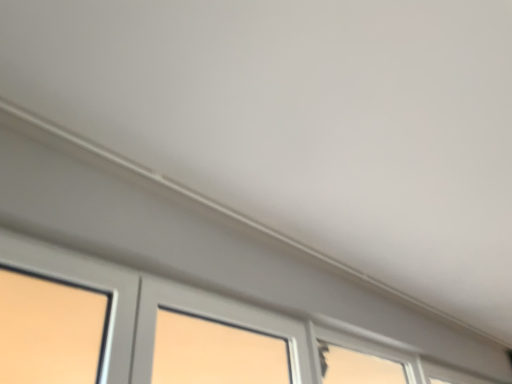
Question: Can we say matte gray window at lower left, the 1th window in the front-to-back sequence, lies outside clear glass window at lower right, arranged as the 1th window when viewed from the right?

Choices:
 (A) yes
 (B) no

Answer: (A)

Question: Does matte gray window at lower left, the 1th window in the front-to-back sequence, turn towards clear glass window at lower right, the third window from the left?

Choices:
 (A) yes
 (B) no

Answer: (B)

Question: From the image's perspective, is matte gray window at lower left, the 1th window in the front-to-back sequence, located beneath clear glass window at lower right, marked as the 3th window in a front-to-back arrangement?

Choices:
 (A) yes
 (B) no

Answer: (B)

Question: Considering the relative sizes of matte gray window at lower left, the third window from the back, and clear glass window at lower right, marked as the 3th window in a front-to-back arrangement, in the image provided, is matte gray window at lower left, the third window from the back, taller than clear glass window at lower right, marked as the 3th window in a front-to-back arrangement,?

Choices:
 (A) no
 (B) yes

Answer: (B)

Question: Is matte gray window at lower left, the 3th window viewed from the right, thinner than clear glass window at lower right, arranged as the 1th window when viewed from the right?

Choices:
 (A) no
 (B) yes

Answer: (A)

Question: Considering the positions of matte gray window at lower left, placed as the first window when sorted from left to right, and clear glass window at lower right, which ranks as the first window in back-to-front order, in the image, is matte gray window at lower left, placed as the first window when sorted from left to right, taller or shorter than clear glass window at lower right, which ranks as the first window in back-to-front order,?

Choices:
 (A) short
 (B) tall

Answer: (B)

Question: From the image's perspective, is matte gray window at lower left, the 1th window in the front-to-back sequence, positioned above or below clear glass window at lower right, which ranks as the first window in back-to-front order?

Choices:
 (A) below
 (B) above

Answer: (B)

Question: Is matte gray window at lower left, the third window from the back, to the left or to the right of clear glass window at lower right, marked as the 3th window in a front-to-back arrangement, in the image?

Choices:
 (A) left
 (B) right

Answer: (A)

Question: Choose the correct answer: Is matte gray window at lower left, the 3th window viewed from the right, inside clear glass window at lower right, marked as the 3th window in a front-to-back arrangement, or outside it?

Choices:
 (A) outside
 (B) inside

Answer: (A)

Question: Is matte gray window at lower left, the 3th window viewed from the right, situated inside transparent glass window at lower right, which ranks as the second window in back-to-front order, or outside?

Choices:
 (A) inside
 (B) outside

Answer: (B)

Question: In the image, is matte gray window at lower left, the 3th window viewed from the right, on the left side or the right side of transparent glass window at lower right, arranged as the second window when viewed from the right?

Choices:
 (A) left
 (B) right

Answer: (A)

Question: Is matte gray window at lower left, the 1th window in the front-to-back sequence, bigger or smaller than transparent glass window at lower right, arranged as the second window when viewed from the right?

Choices:
 (A) big
 (B) small

Answer: (A)

Question: Considering the positions of point (304, 349) and point (351, 359), is point (304, 349) closer or farther from the camera than point (351, 359)?

Choices:
 (A) farther
 (B) closer

Answer: (B)

Question: Relative to transparent glass window at lower right, the second window viewed from the left, is clear glass window at lower right, the third window from the left, in front or behind?

Choices:
 (A) front
 (B) behind

Answer: (B)

Question: Is clear glass window at lower right, which ranks as the first window in back-to-front order, situated inside transparent glass window at lower right, the second window viewed from the left, or outside?

Choices:
 (A) inside
 (B) outside

Answer: (B)